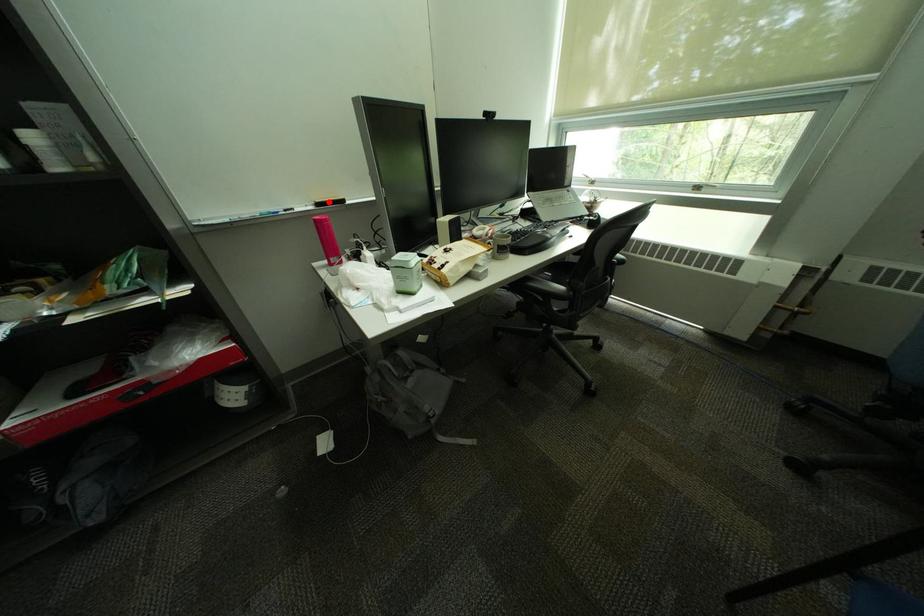
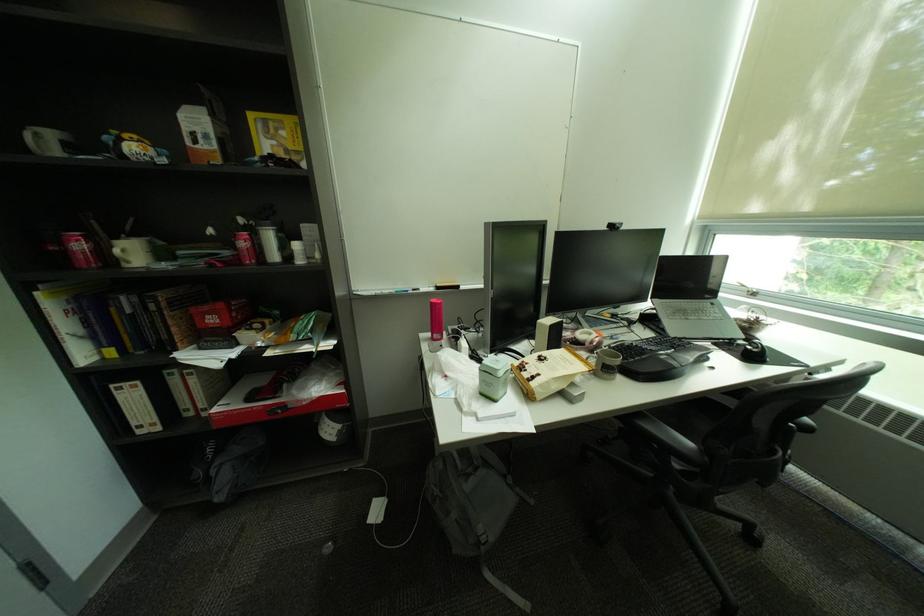
The point at the highlighted location is marked in the first image. Where is the corresponding point in the second image?

(450, 286)